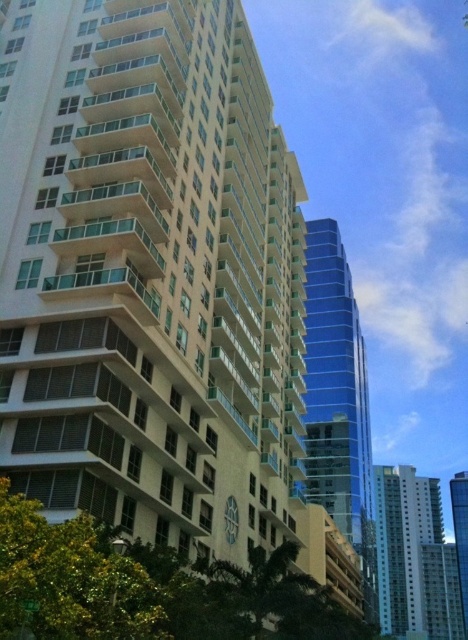
Does shiny blue glass tower at center appear over green leafy tree at lower left?

Actually, shiny blue glass tower at center is below green leafy tree at lower left.

Who is positioned more to the left, shiny blue glass tower at center or green leafy tree at lower left?

green leafy tree at lower left is more to the left.

This screenshot has height=640, width=468. I want to click on shiny blue glass tower at center, so click(x=337, y=403).

Does shiny blue glass tower at center have a lesser width compared to glassy blue skyscraper at right?

Yes, shiny blue glass tower at center is thinner than glassy blue skyscraper at right.

Locate an element on the screen. The height and width of the screenshot is (640, 468). shiny blue glass tower at center is located at coordinates (337, 403).

Which is behind, point (63, 598) or point (258, 621)?

Point (258, 621)

You are a GUI agent. You are given a task and a screenshot of the screen. Output one action in this format:
    pyautogui.click(x=<x>, y=<y>)
    Task: Click on the green leafy tree at lower left
    
    Given the screenshot: What is the action you would take?
    pyautogui.click(x=68, y=580)